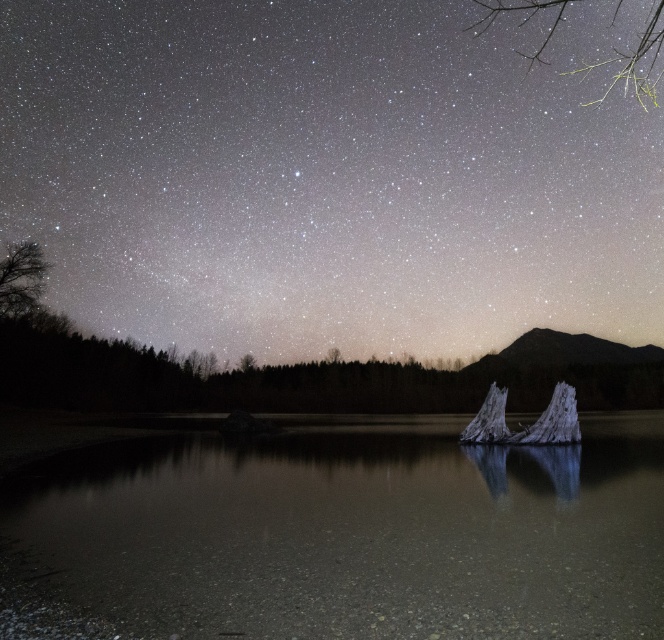
You are an observer standing at the lakeside. You notice the green leafy branches at upper right and the dark brown textured tree at left. Which object appears taller in the scene?

The green leafy branches at upper right appears taller than the dark brown textured tree at left according to the description.

You are an artist sketching the night scene. You notice the green leafy branches at upper right and the dark brown textured tree at left. Which object would you need to draw first if you follow the rule of drawing closer objects before distant ones?

The green leafy branches at upper right are closer than the dark brown textured tree at left, so you should draw the green leafy branches at upper right first.